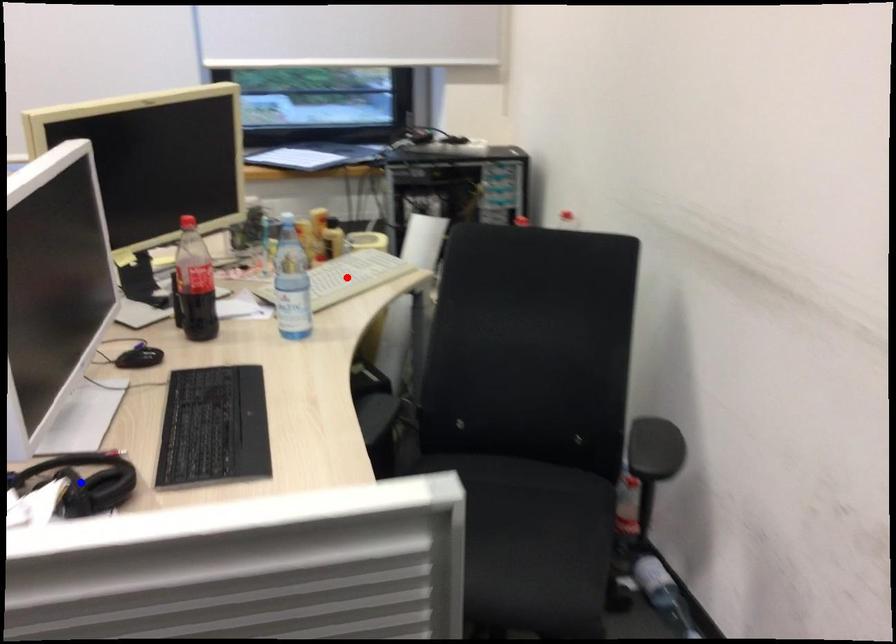
Question: Which of the two points in the image is closer to the camera?

Choices:
 (A) Blue point is closer.
 (B) Red point is closer.

Answer: (A)